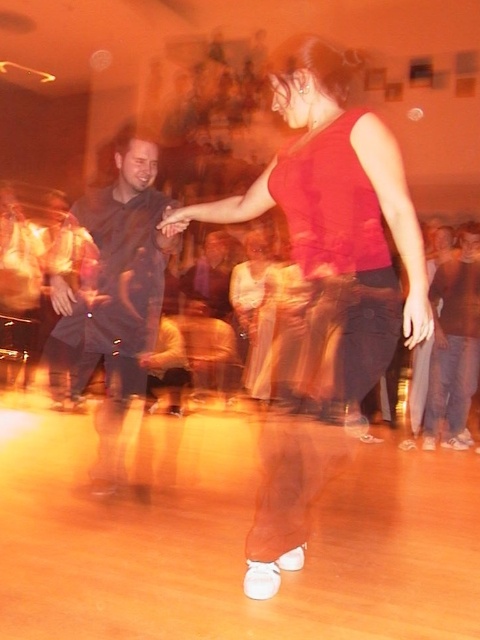
You are a photographer standing at the back of the dance floor. You want to take a closeup photo of the matte red tank top at center. Can you estimate how far you need to walk forward to get the perfect shot?

The matte red tank top at center is 1.86 meters away from the camera. To take a closeup photo, you need to walk forward until you are approximately 1.86 meters away from the matte red tank top at center.